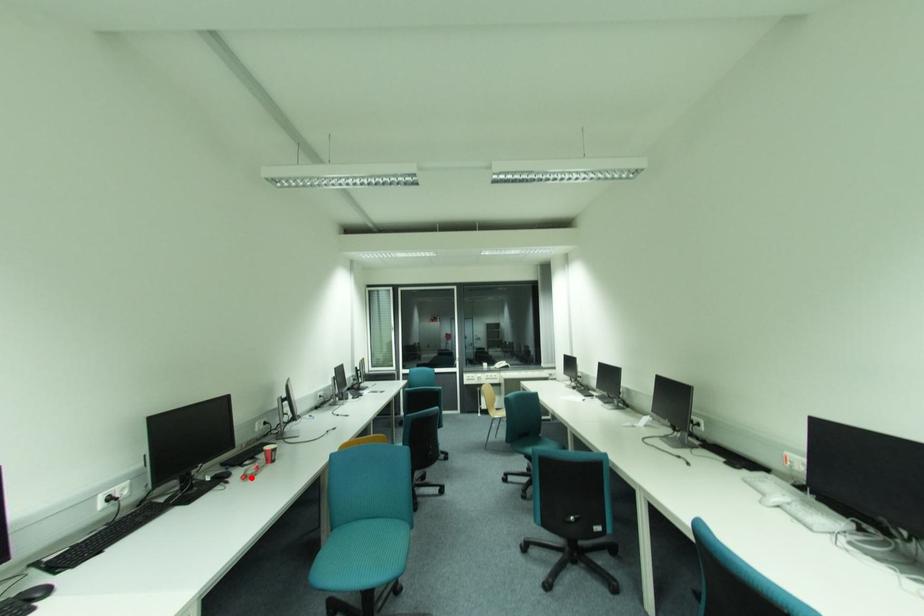
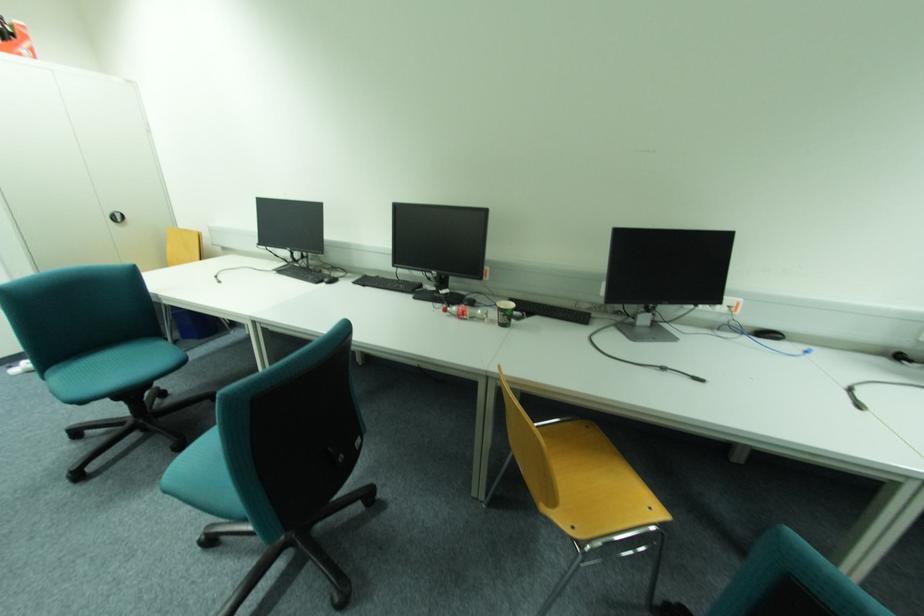
In the second image, find the point that corresponds to the highlighted location in the first image.

(451, 310)